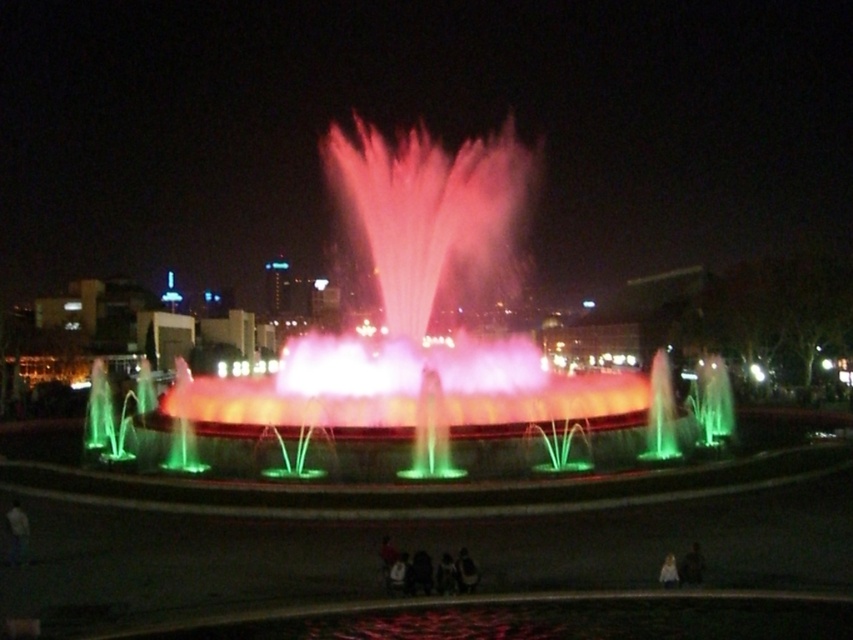
Who is positioned more to the right, illuminated water at center or light brown leather jacket at lower right?

light brown leather jacket at lower right

Which is below, illuminated water at center or light brown leather jacket at lower right?

light brown leather jacket at lower right is lower down.

Does point (625, 394) lie behind point (666, 572)?

Yes, it is behind point (666, 572).

At what (x,y) coordinates should I click in order to perform the action: click on illuminated water at center. Please return your answer as a coordinate pair (x, y). The image size is (853, 640). Looking at the image, I should click on (416, 355).